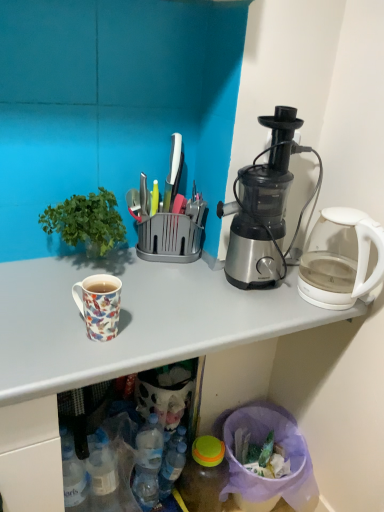
Question: Would you say white glossy mug at upper left is a long distance from satin silver blender at right?

Choices:
 (A) no
 (B) yes

Answer: (A)

Question: Can you confirm if white glossy mug at upper left is positioned to the left of satin silver blender at right?

Choices:
 (A) no
 (B) yes

Answer: (B)

Question: Is white glossy mug at upper left thinner than satin silver blender at right?

Choices:
 (A) no
 (B) yes

Answer: (A)

Question: Can you confirm if white glossy mug at upper left is positioned to the right of satin silver blender at right?

Choices:
 (A) yes
 (B) no

Answer: (B)

Question: Is white glossy mug at upper left surrounding satin silver blender at right?

Choices:
 (A) no
 (B) yes

Answer: (A)

Question: Does white glossy mug at upper left have a lesser height compared to satin silver blender at right?

Choices:
 (A) yes
 (B) no

Answer: (B)

Question: Is white glossy mug at upper left at the back of satin silver blender at right?

Choices:
 (A) no
 (B) yes

Answer: (A)

Question: From a real-world perspective, is satin silver blender at right over white glossy mug at upper left?

Choices:
 (A) yes
 (B) no

Answer: (A)

Question: Does satin silver blender at right appear on the left side of white glossy mug at upper left?

Choices:
 (A) yes
 (B) no

Answer: (B)

Question: Does satin silver blender at right have a smaller size compared to white glossy mug at upper left?

Choices:
 (A) no
 (B) yes

Answer: (B)

Question: Does satin silver blender at right have a larger size compared to white glossy mug at upper left?

Choices:
 (A) no
 (B) yes

Answer: (A)

Question: Is satin silver blender at right positioned beyond the bounds of white glossy mug at upper left?

Choices:
 (A) yes
 (B) no

Answer: (A)

Question: Is translucent plastic bottle at lower center, acting as the second bottle starting from the right, to the left of green leafy plant at left from the viewer's perspective?

Choices:
 (A) no
 (B) yes

Answer: (A)